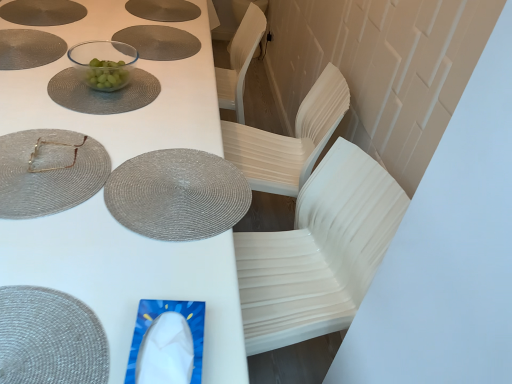
Find the location of a particular element. empty space that is to the right of matte gray placemat at upper left, the second plate positioned from the right is located at coordinates (82, 58).